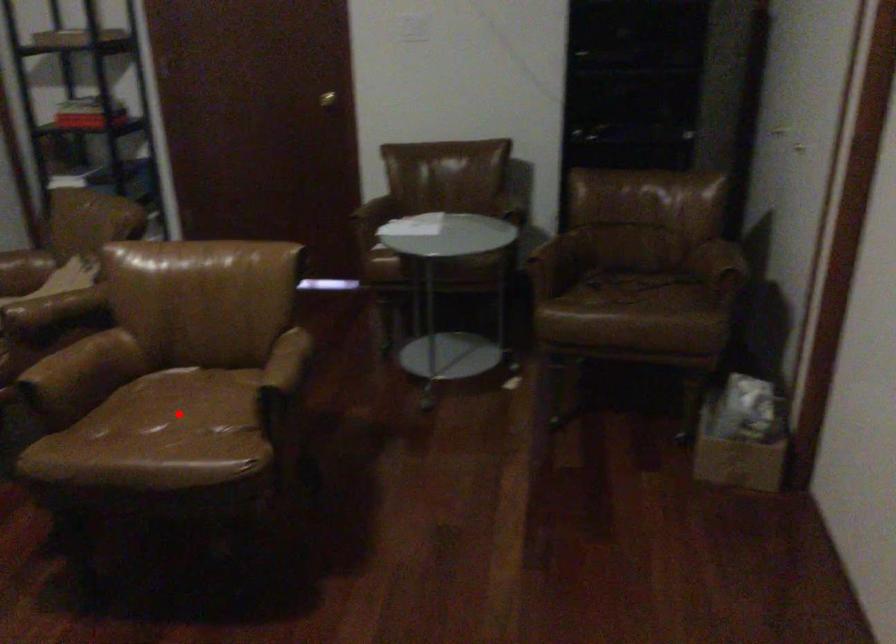
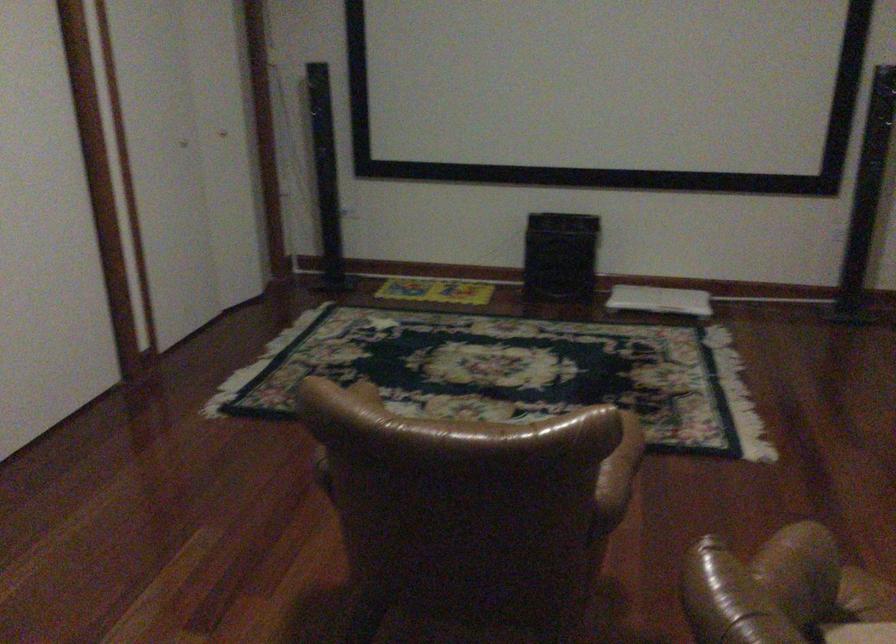
Question: I am providing you with two images of the same scene from different viewpoints. A red point is marked on the first image. Can you still see the location of the red point in image 2?

Choices:
 (A) Yes
 (B) No

Answer: (B)